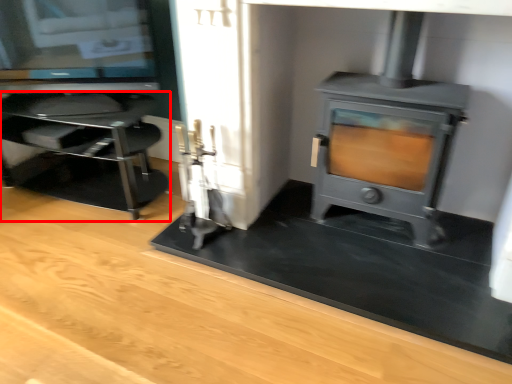
Question: From the image's perspective, where is furniture (annotated by the red box) located in relation to wood burning stove in the image?

Choices:
 (A) below
 (B) above

Answer: (A)